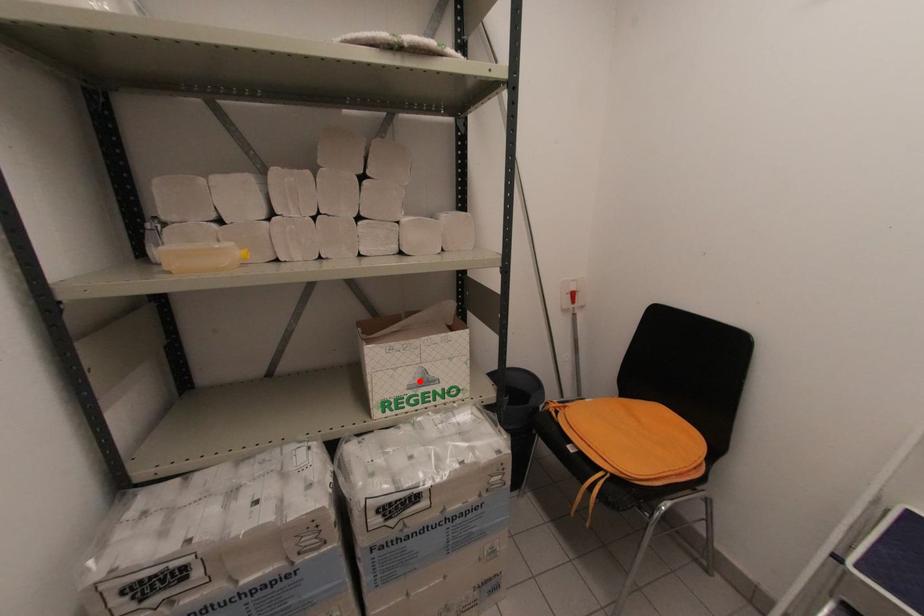
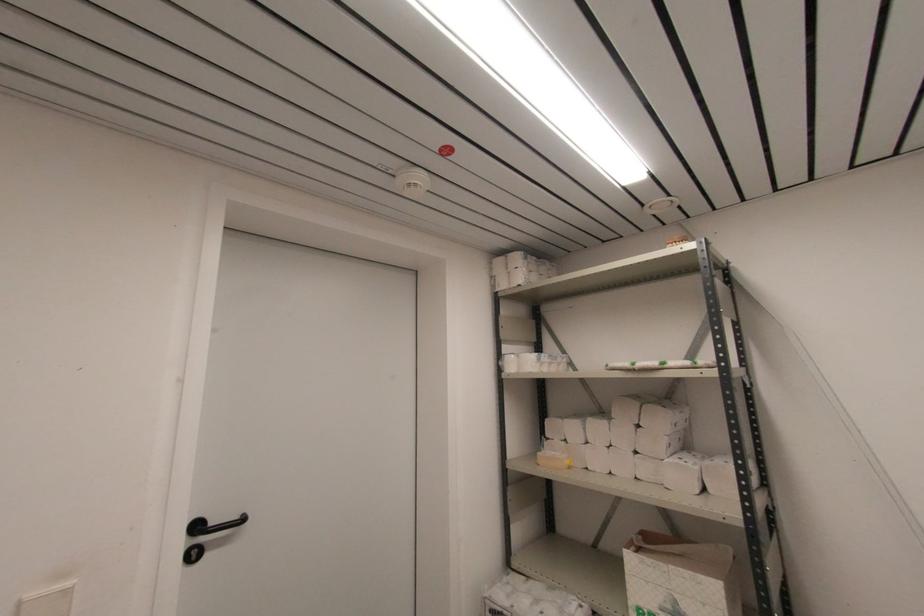
The point at the highlighted location is marked in the first image. Where is the corresponding point in the second image?

(671, 609)